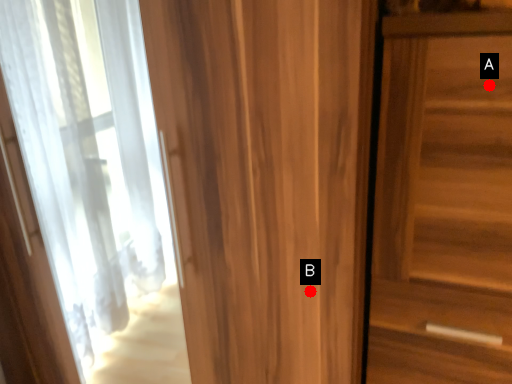
Question: Two points are circled on the image, labeled by A and B beside each circle. Which of the following is the closest to the observer?

Choices:
 (A) A is closer
 (B) B is closer

Answer: (A)